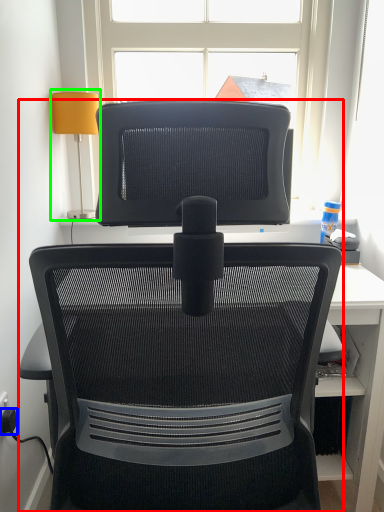
Question: Which object is the closest to the chair (highlighted by a red box)? Choose among these: plug (highlighted by a blue box) or table lamp (highlighted by a green box).

Choices:
 (A) plug
 (B) table lamp

Answer: (A)